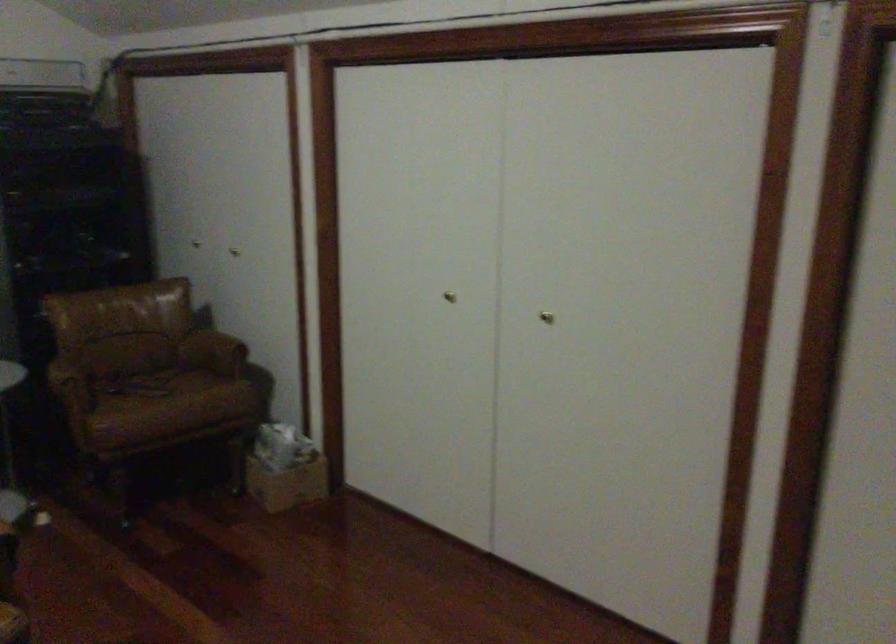
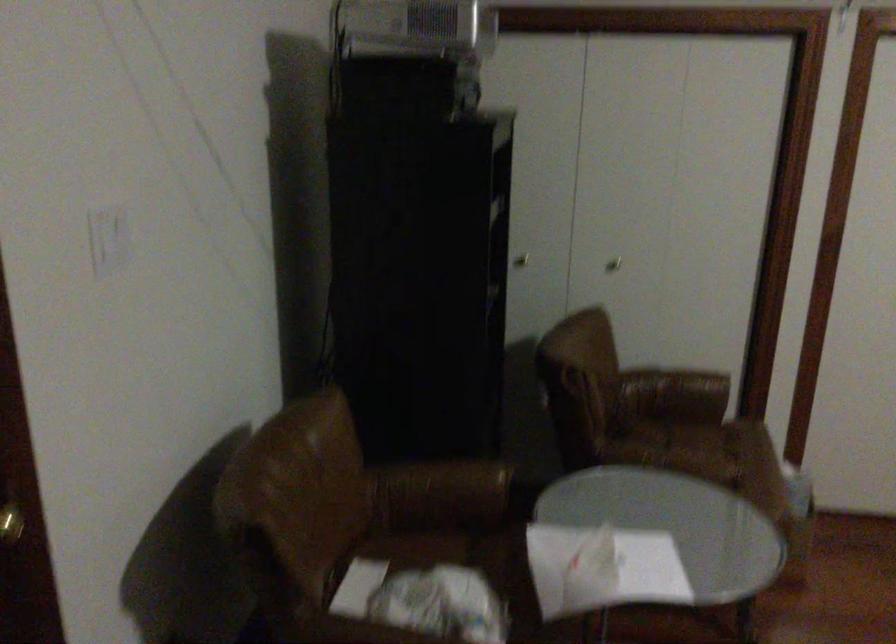
Where in the second image is the point corresponding to the point at 237,250 from the first image?

(613, 263)